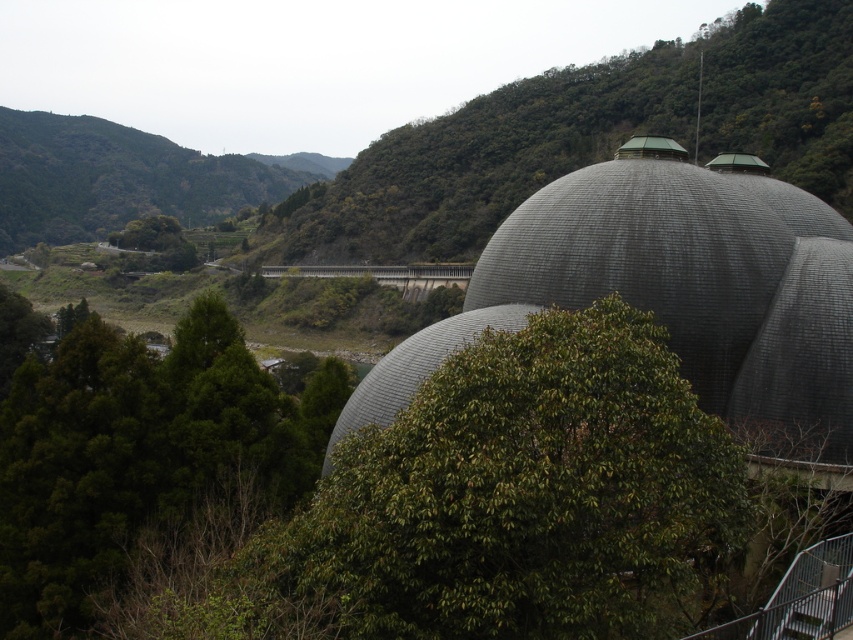
Question: Is green leafy tree at center wider than green leafy tree at lower left?

Choices:
 (A) no
 (B) yes

Answer: (B)

Question: Among these objects, which one is farthest from the camera?

Choices:
 (A) gray textured dome at center
 (B) green leafy tree at center
 (C) green leafy tree at lower left

Answer: (B)

Question: Among these points, which one is nearest to the camera?

Choices:
 (A) (838, 419)
 (B) (65, 435)
 (C) (544, 145)

Answer: (B)

Question: Considering the relative positions of green leafy tree at center and green leafy tree at lower left in the image provided, where is green leafy tree at center located with respect to green leafy tree at lower left?

Choices:
 (A) left
 (B) right

Answer: (B)

Question: In this image, where is gray textured dome at center located relative to green leafy tree at lower left?

Choices:
 (A) right
 (B) left

Answer: (A)

Question: Which object is the farthest from the green leafy tree at lower left?

Choices:
 (A) green leafy tree at center
 (B) gray textured dome at center

Answer: (A)